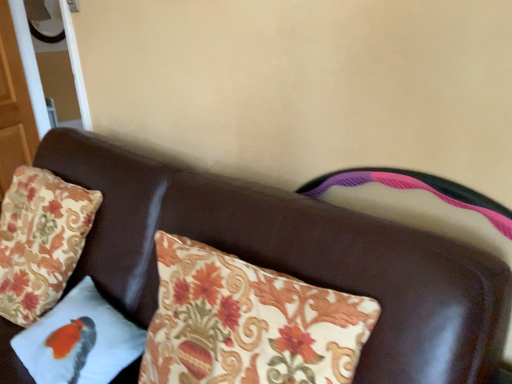
Question: Is white fabric pillow with bird design at lower left, the 2th pillow viewed from the left, taller or shorter than brown leather couch at center?

Choices:
 (A) short
 (B) tall

Answer: (A)

Question: From a real-world perspective, is white fabric pillow with bird design at lower left, the 2th pillow viewed from the left, above or below brown leather couch at center?

Choices:
 (A) below
 (B) above

Answer: (B)

Question: Which is farther from the brown leather couch at center?

Choices:
 (A) white fabric pillow with bird design at lower left, positioned as the first pillow in right-to-left order
 (B) floral fabric pillow at left, which is counted as the 2th pillow, starting from the right

Answer: (B)

Question: Considering the real-world distances, which object is closest to the white fabric pillow with bird design at lower left, positioned as the first pillow in right-to-left order?

Choices:
 (A) floral fabric pillow at left, arranged as the 1th pillow when viewed from the left
 (B) brown leather couch at center

Answer: (B)